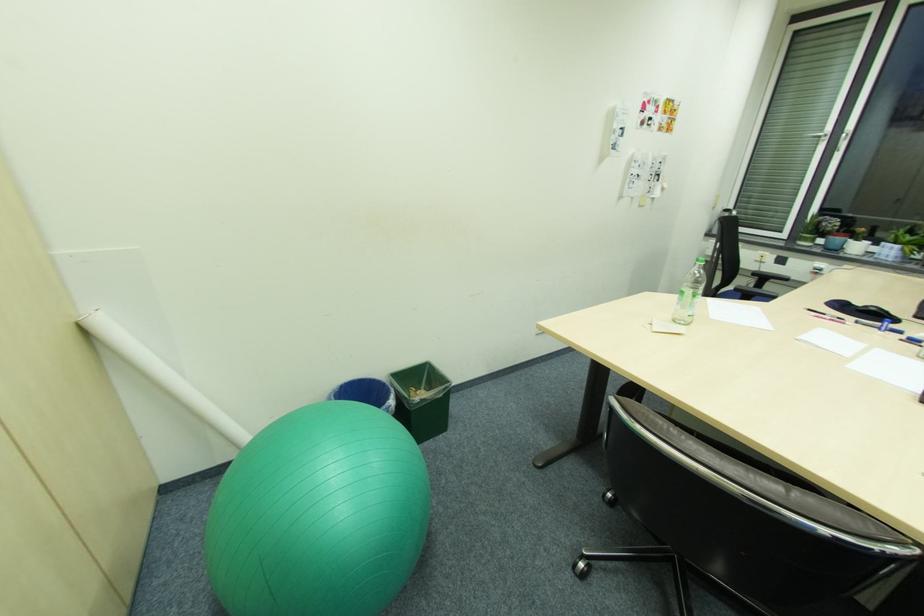
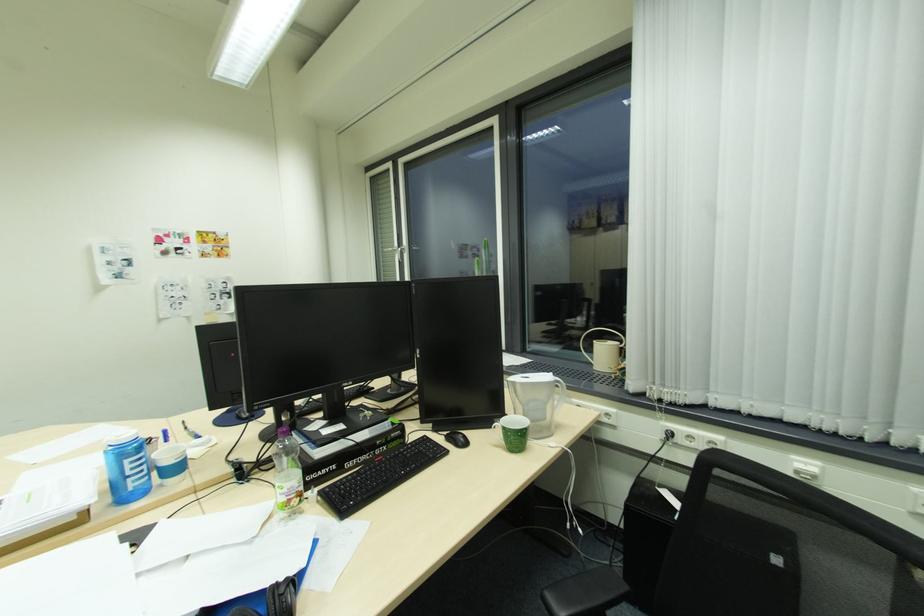
In the second image, find the point that corresponds to point 627,132 in the first image.

(131, 262)